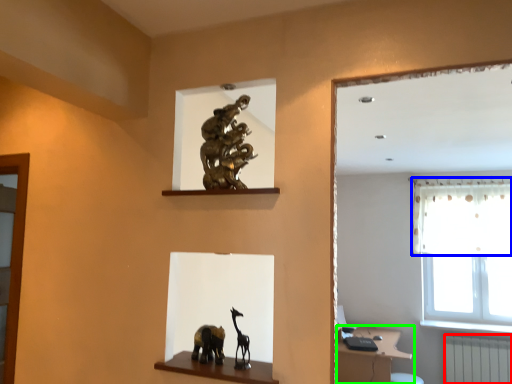
Question: Considering the real-world distances, which object is farthest from radiator (highlighted by a red box)? curtain (highlighted by a blue box) or vanity (highlighted by a green box)?

Choices:
 (A) curtain
 (B) vanity

Answer: (A)